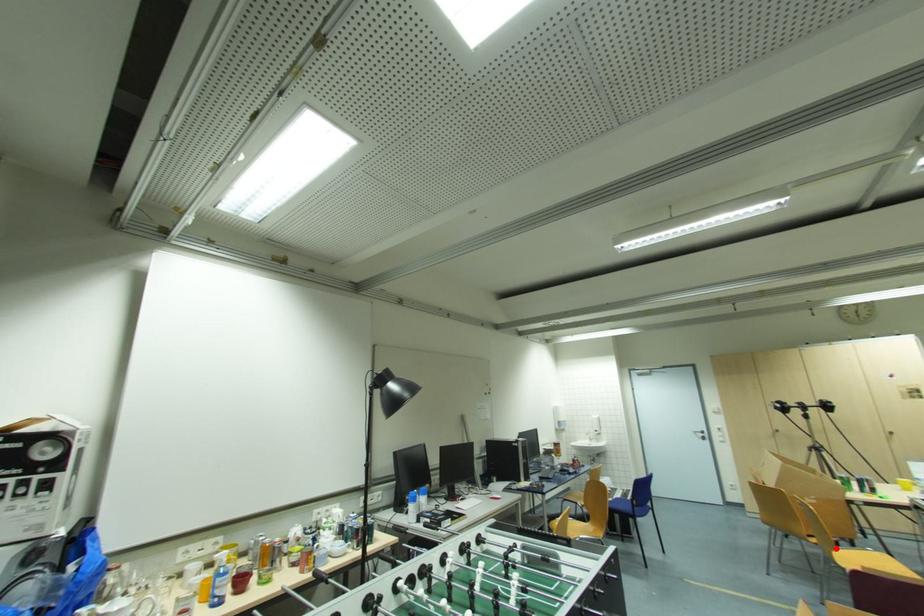
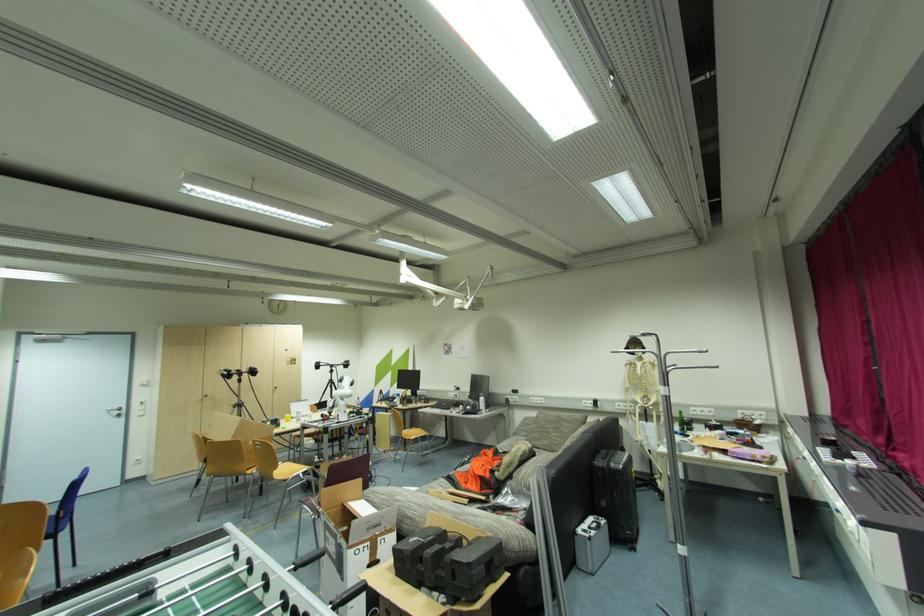
Question: I am providing you with two images of the same scene from different viewpoints. In image1, a red point is highlighted. Considering the same 3D point in image2, which of the following is correct?

Choices:
 (A) It is closer
 (B) It is farther

Answer: (B)